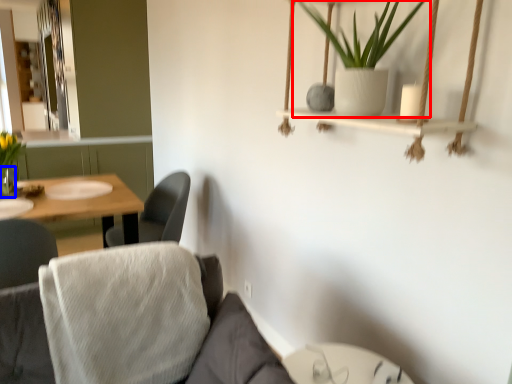
Question: Which object appears farthest to the camera in this image, houseplant (highlighted by a red box) or glass vase (highlighted by a blue box)?

Choices:
 (A) houseplant
 (B) glass vase

Answer: (B)